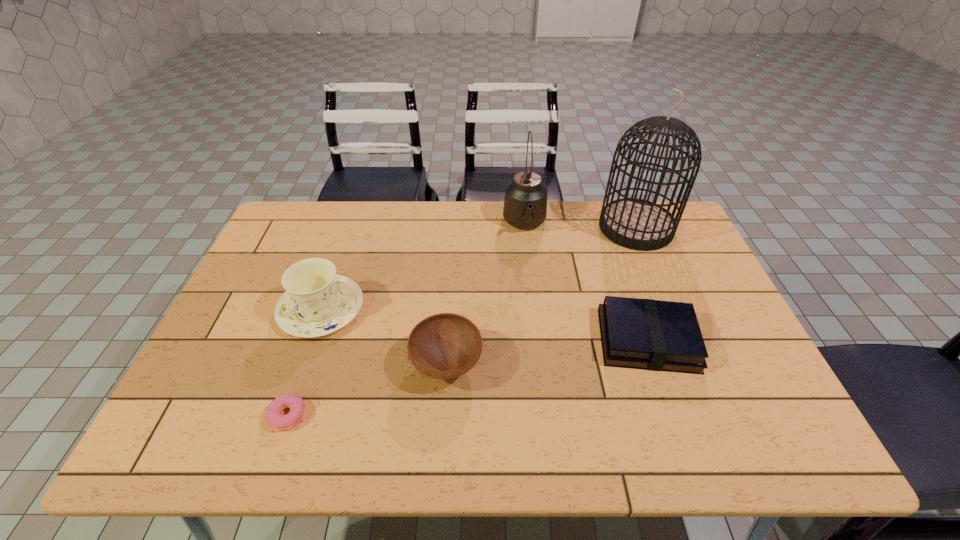
The height and width of the screenshot is (540, 960). In order to click on birdcage in this screenshot , I will do `click(638, 224)`.

The image size is (960, 540). What are the coordinates of `kettle` in the screenshot? It's located at (525, 205).

At what (x,y) coordinates should I click in order to perform the action: click on the fourth object from left to right. Please return your answer as a coordinate pair (x, y). The image size is (960, 540). Looking at the image, I should click on (525, 205).

At what (x,y) coordinates should I click in order to perform the action: click on chinaware. Please return your answer as a coordinate pair (x, y). This screenshot has height=540, width=960. Looking at the image, I should click on (317, 302).

I want to click on bowl, so click(443, 346).

Locate an element on the screen. The image size is (960, 540). the third object from left to right is located at coordinates (443, 346).

Find the location of a particular element. the fifth tallest object is located at coordinates (649, 334).

Find the location of `the shortest object`. the shortest object is located at coordinates point(296,404).

This screenshot has width=960, height=540. Find the location of `doughnut`. doughnut is located at coordinates (296, 404).

Where is `vacant space positioned on the left of the birdcage`? vacant space positioned on the left of the birdcage is located at coordinates (498, 228).